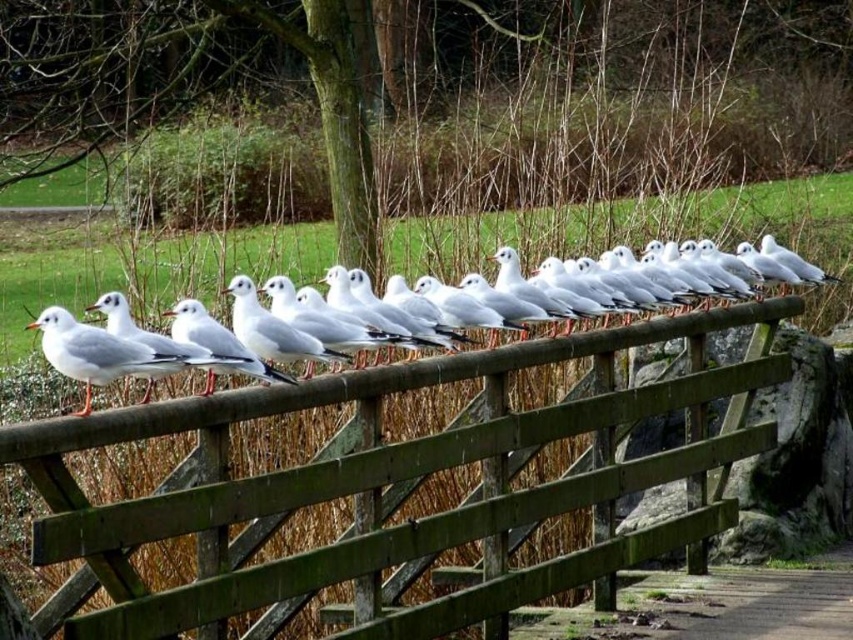
You are a birdwatcher observing the white matte seagull at center and the white matte seagull at left. Which seagull appears larger in size?

The white matte seagull at center appears larger in size compared to the white matte seagull at left.

You are a birdwatcher standing in the park and see the wooden fence at center and the white matte seagull at left. Which object is taller?

The wooden fence at center is much taller than the white matte seagull at left.

You are standing in the park and see a wooden fence at center. There is a point marked at coordinates (399, 483). Can you tell me where this point is located?

The point at (399, 483) is located on the wooden fence at center.